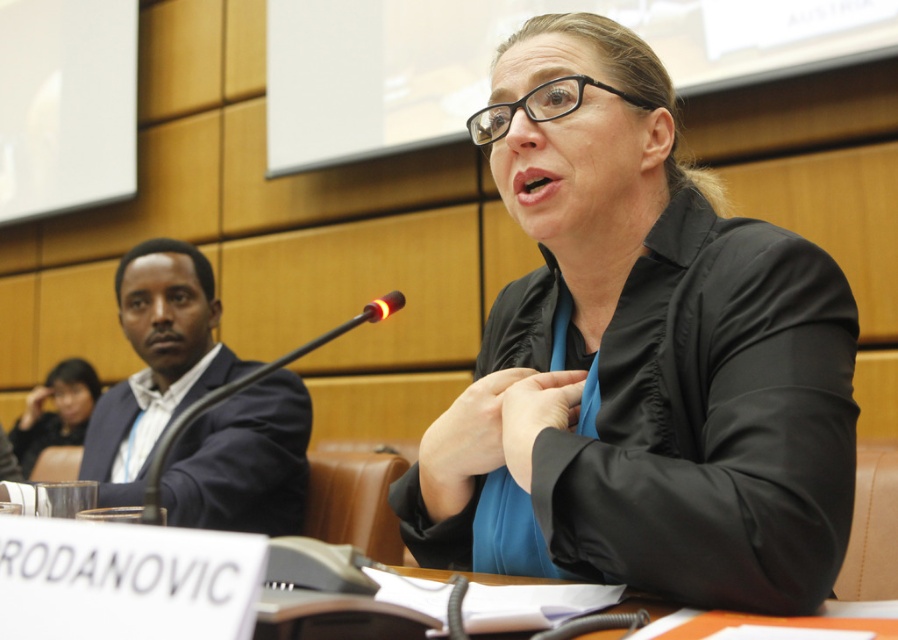
You are a participant in the meeting and want to reach for the orange paper at lower center during the presentation. If your hand can extend 40 centimeters, can you comfortably reach it without leaving your seat?

The orange paper at lower center is 41.96 centimeters away from the viewer. Since your hand can only extend 40 centimeters, you cannot comfortably reach it without leaving your seat.

You are organizing a presentation and need to place both the black matte blazer at center and the orange paper at lower center on a narrow shelf. Based on their sizes, which item should you place first to ensure both fit?

The orange paper at lower center should be placed first since the black matte blazer at center is wider, and placing the narrower item first allows the wider one to fit alongside without overcrowding the shelf.

You are organizing a presentation and need to place the orange paper at lower center on top of the black matte blazer at center. Is this possible based on their sizes?

The black matte blazer at center has a greater height compared to orange paper at lower center. Therefore, placing the orange paper at lower center on top of the black matte blazer at center would not be possible since the blazer is taller than the paper.